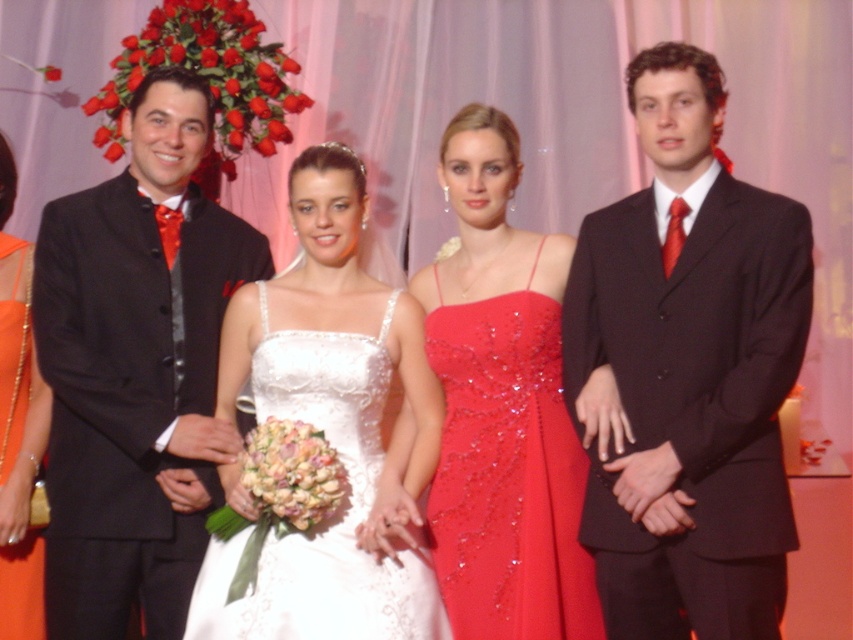
You are standing at the entrance of the event venue and see two points marked in the image. The first point is at coordinate point (x=444, y=531) and the second is at point (x=3, y=586). Which point is closer to you?

Point (x=444, y=531) is in front of point (x=3, y=586), so it is closer to you.

You are a photographer at a formal event and need to adjust the camera focus. The shiny sequined dress at center and the orange satin dress at left are in your frame. Since they are 1.23 meters apart, will you need to adjust the focus to capture both clearly in the same photo?

The shiny sequined dress at center and the orange satin dress at left are 1.23 meters apart from each other. To capture both clearly in the same photo, the photographer should ensure the camera has a sufficient depth of field to accommodate the 1.23 meters distance between them.

You are a photographer at the event and need to position two guests for a group photo. The guests are wearing the shiny sequined dress at center and the satin white dress at center. Since the dresses have different widths, which guest should you place closer to the camera to ensure both are fully visible in the frame?

The shiny sequined dress at center is narrower than the satin white dress at center. To ensure both are fully visible, position the narrower shiny sequined dress at center closer to the camera so it appears larger in the frame, balancing their sizes.